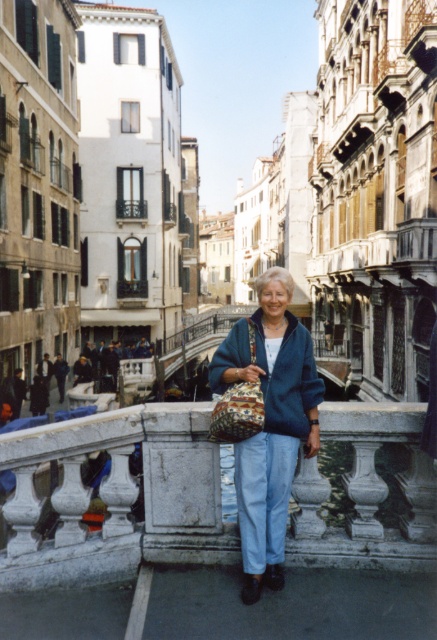
Is white marble railing at center below denim jacket at center?

Correct, white marble railing at center is located below denim jacket at center.

Image resolution: width=437 pixels, height=640 pixels. In order to click on white marble railing at center in this screenshot , I will do `click(117, 497)`.

Identify the location of white marble railing at center. (117, 497).

Is denim jacket at center in front of blue woolen cardigan at center?

That is True.

Locate an element on the screen. The height and width of the screenshot is (640, 437). denim jacket at center is located at coordinates click(270, 422).

I want to click on denim jacket at center, so click(x=270, y=422).

Can you confirm if white marble railing at center is shorter than blue woolen cardigan at center?

In fact, white marble railing at center may be taller than blue woolen cardigan at center.

Can you confirm if white marble railing at center is thinner than blue woolen cardigan at center?

No.

Is point (433, 483) closer to camera compared to point (221, 384)?

Yes, it is in front of point (221, 384).

This screenshot has height=640, width=437. Find the location of `white marble railing at center`. white marble railing at center is located at coordinates (117, 497).